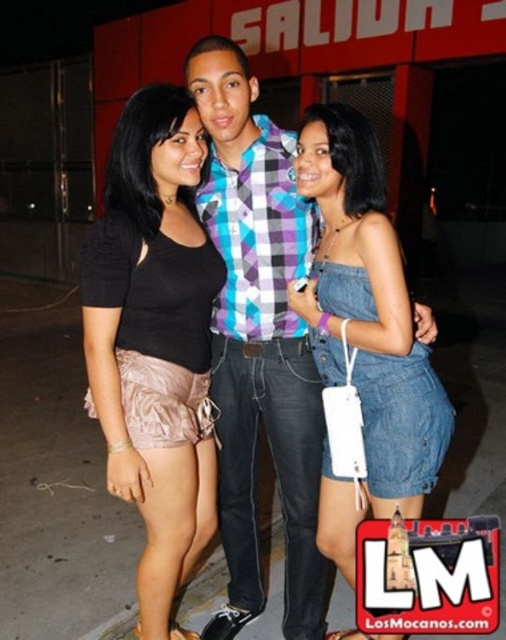
Question: Can you confirm if matte black top at center is positioned to the left of plaid shirt at center?

Choices:
 (A) yes
 (B) no

Answer: (A)

Question: Among these points, which one is farthest from the camera?

Choices:
 (A) (144, 515)
 (B) (323, 492)

Answer: (B)

Question: Considering the relative positions of matte black top at center and denim dress at center in the image provided, where is matte black top at center located with respect to denim dress at center?

Choices:
 (A) below
 (B) above

Answer: (B)

Question: Which is farther from the plaid shirt at center?

Choices:
 (A) denim dress at center
 (B) matte black top at center

Answer: (B)

Question: Considering the real-world distances, which object is farthest from the denim dress at center?

Choices:
 (A) plaid shirt at center
 (B) matte black top at center

Answer: (B)

Question: Is matte black top at center to the left of denim dress at center from the viewer's perspective?

Choices:
 (A) yes
 (B) no

Answer: (A)